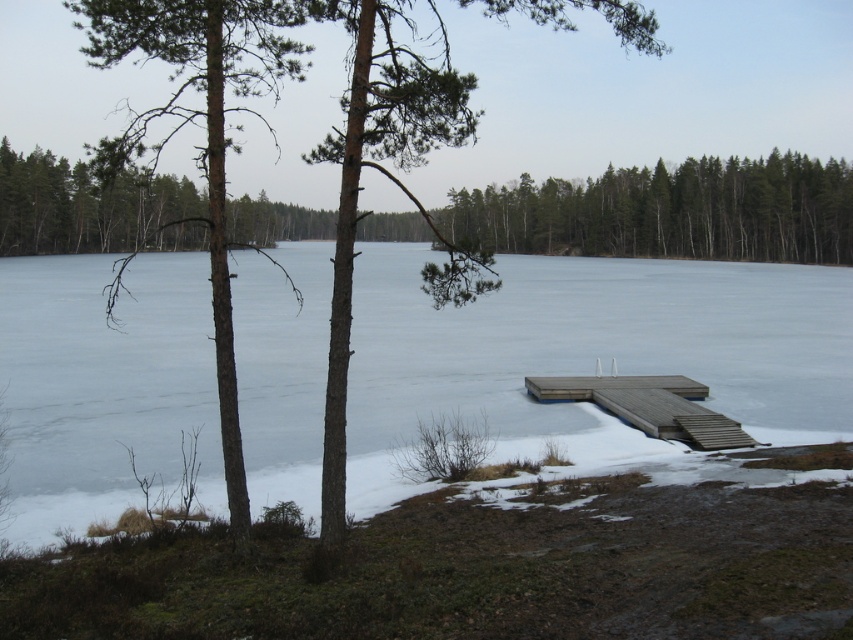
Who is shorter, brown textured tree at center or smooth brown tree trunk at left?

With less height is smooth brown tree trunk at left.

The height and width of the screenshot is (640, 853). What do you see at coordinates (305, 161) in the screenshot?
I see `brown textured tree at center` at bounding box center [305, 161].

Image resolution: width=853 pixels, height=640 pixels. What are the coordinates of `brown textured tree at center` in the screenshot? It's located at (305, 161).

Which is below, smooth brown tree trunk at left or brown wooden dock at center?

Positioned lower is brown wooden dock at center.

Find the location of `smooth brown tree trunk at left`. smooth brown tree trunk at left is located at coordinates (206, 134).

Who is taller, smooth brown tree trunk at left or brown wooden dock at lower right?

smooth brown tree trunk at left

Which is in front, point (242, 541) or point (666, 413)?

Positioned in front is point (242, 541).

I want to click on smooth brown tree trunk at left, so click(206, 134).